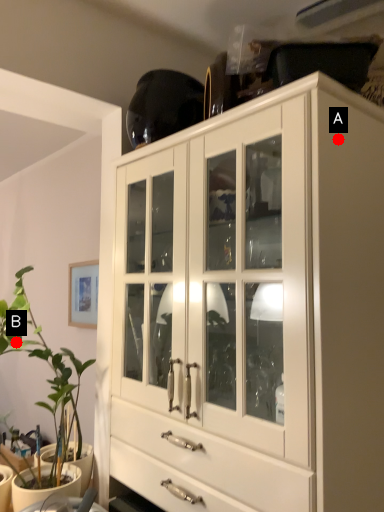
Question: Two points are circled on the image, labeled by A and B beside each circle. Which point is closer to the camera?

Choices:
 (A) A is closer
 (B) B is closer

Answer: (A)